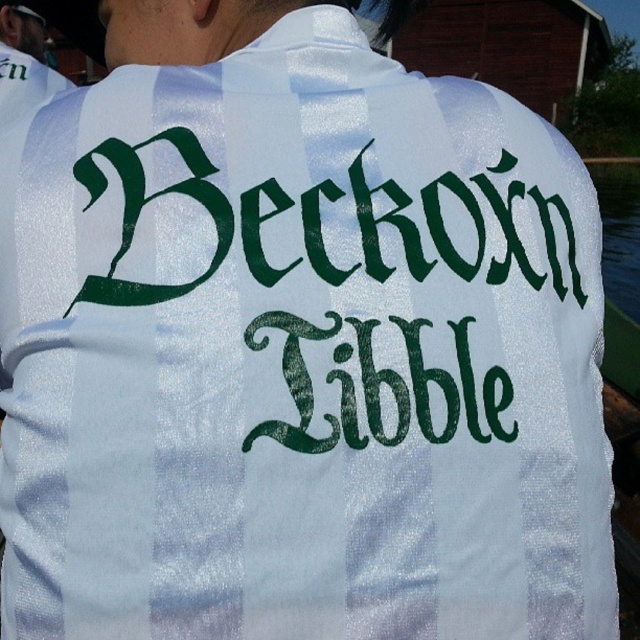
Question: Among these points, which one is farthest from the camera?

Choices:
 (A) (632, 310)
 (B) (13, 60)

Answer: (A)

Question: Which point appears farthest from the camera in this image?

Choices:
 (A) (611, 237)
 (B) (6, 51)

Answer: (A)

Question: Which of the following is the closest to the observer?

Choices:
 (A) transparent plastic water at right
 (B) white glossy shirt at upper left

Answer: (A)

Question: Does transparent plastic water at right have a lesser width compared to white glossy shirt at upper left?

Choices:
 (A) yes
 (B) no

Answer: (B)

Question: Can you confirm if transparent plastic water at right is smaller than white glossy shirt at upper left?

Choices:
 (A) no
 (B) yes

Answer: (A)

Question: Does transparent plastic water at right appear over white glossy shirt at upper left?

Choices:
 (A) yes
 (B) no

Answer: (A)